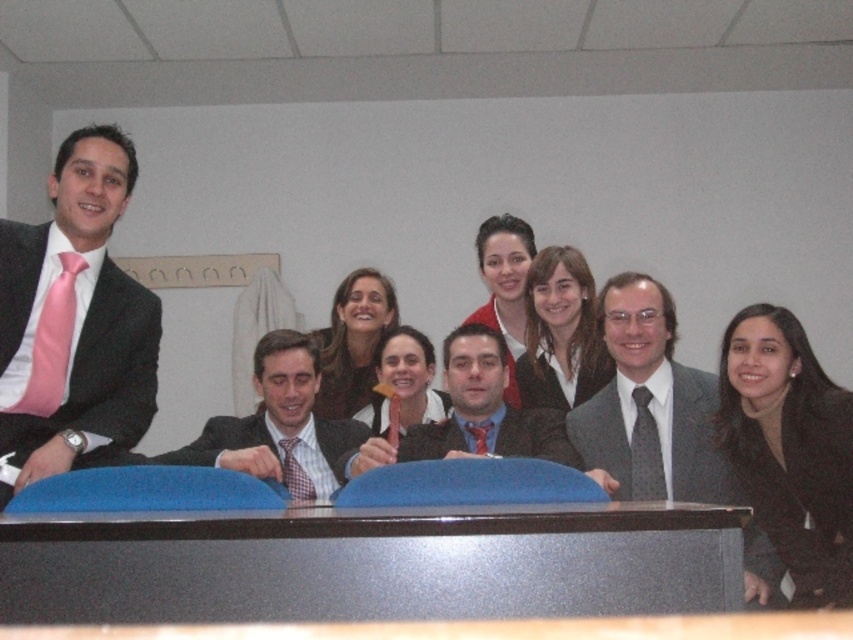
Is point (0, 326) positioned in front of point (490, 243)?

Yes, it is.

Between matte pink tie at left and matte red sweater at center, which one appears on the right side from the viewer's perspective?

From the viewer's perspective, matte red sweater at center appears more on the right side.

This screenshot has height=640, width=853. Identify the location of matte pink tie at left. (74, 321).

Locate an element on the screen. matte pink tie at left is located at coordinates (74, 321).

Find the location of `smooth black hair at center`. smooth black hair at center is located at coordinates (560, 333).

Can you confirm if smooth black hair at center is positioned to the right of matte white shirt at center?

Indeed, smooth black hair at center is positioned on the right side of matte white shirt at center.

From the picture: Who is more forward, (590, 384) or (426, 406)?

Point (590, 384)

Locate an element on the screen. The width and height of the screenshot is (853, 640). smooth black hair at center is located at coordinates (560, 333).

Is black smooth blazer at lower right taller than gray textured suit at center?

No, black smooth blazer at lower right is not taller than gray textured suit at center.

Can you confirm if black smooth blazer at lower right is bigger than gray textured suit at center?

No, black smooth blazer at lower right is not bigger than gray textured suit at center.

Which is in front, point (804, 540) or point (630, 272)?

Positioned in front is point (804, 540).

Find the location of a particular element. black smooth blazer at lower right is located at coordinates (788, 449).